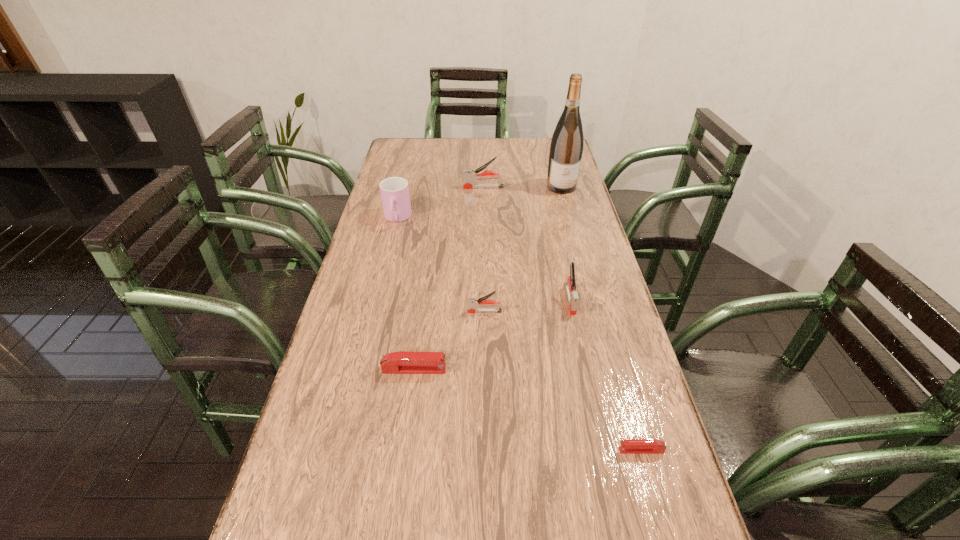
This screenshot has width=960, height=540. Identify the location of vacant space located on the handle side of the smallest gray stapler. (445, 312).

Locate an element on the screen. free spot located 0.230m on the handle side of the smallest gray stapler is located at coordinates (382, 312).

At what (x,y) coordinates should I click in order to perform the action: click on free space located 0.070m on the handle side of the smallest gray stapler. Please return your answer as a coordinate pair (x, y). The width and height of the screenshot is (960, 540). Looking at the image, I should click on (442, 312).

This screenshot has width=960, height=540. Identify the location of vacant space located 0.050m on the front-facing side of the second object from left to right. (468, 369).

Image resolution: width=960 pixels, height=540 pixels. I want to click on blank space located on the front-facing side of the rightmost stapler, so click(x=535, y=450).

Identify the location of free region located on the front-facing side of the rightmost stapler. Image resolution: width=960 pixels, height=540 pixels. (550, 450).

Locate an element on the screen. This screenshot has width=960, height=540. vacant space located on the front-facing side of the rightmost stapler is located at coordinates (436, 450).

You are a GUI agent. You are given a task and a screenshot of the screen. Output one action in this format:
    pyautogui.click(x=<x>, y=<y>)
    Task: Click on the cup that is positioned at the left edge
    The image size is (960, 540).
    Given the screenshot: What is the action you would take?
    pyautogui.click(x=394, y=191)

Locate an element on the screen. The height and width of the screenshot is (540, 960). stapler that is at the left edge is located at coordinates (402, 362).

Image resolution: width=960 pixels, height=540 pixels. Find the location of `wine bottle located at the right edge`. wine bottle located at the right edge is located at coordinates (566, 148).